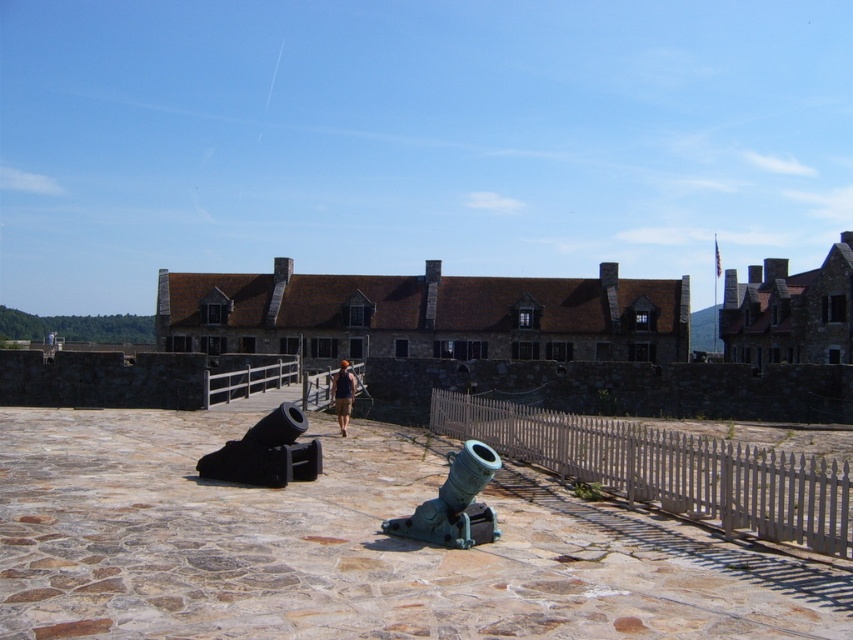
Is green patina metal cannon at center taller than brown fabric shirt at center?

Incorrect, green patina metal cannon at center's height is not larger of brown fabric shirt at center's.

Who is more forward, (399,531) or (349,401)?

Positioned in front is point (399,531).

Locate an element on the screen. green patina metal cannon at center is located at coordinates (456, 502).

Does black matte cannon at lower left have a smaller size compared to brown fabric shirt at center?

Indeed, black matte cannon at lower left has a smaller size compared to brown fabric shirt at center.

Can you confirm if black matte cannon at lower left is shorter than brown fabric shirt at center?

Yes, black matte cannon at lower left is shorter than brown fabric shirt at center.

Does point (267, 428) come in front of point (332, 388)?

Yes, point (267, 428) is in front of point (332, 388).

Image resolution: width=853 pixels, height=640 pixels. What are the coordinates of `black matte cannon at lower left` in the screenshot? It's located at (265, 452).

Is white picket fence at center thinner than green patina metal cannon at center?

No.

The image size is (853, 640). I want to click on white picket fence at center, so click(x=669, y=468).